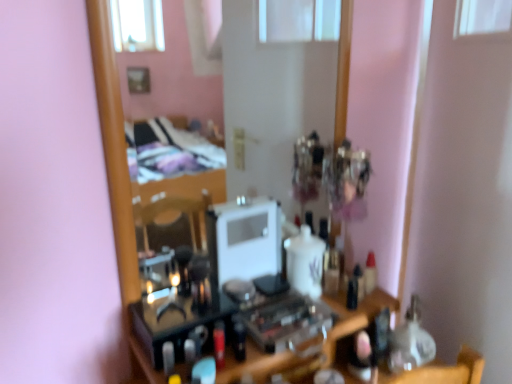
Question: From the image's perspective, is wooden mirror at center above or below translucent plastic bottle at center?

Choices:
 (A) above
 (B) below

Answer: (A)

Question: Is wooden mirror at center to the left or to the right of translucent plastic bottle at center in the image?

Choices:
 (A) left
 (B) right

Answer: (A)

Question: Is wooden mirror at center in front of or behind translucent plastic bottle at center in the image?

Choices:
 (A) behind
 (B) front

Answer: (B)

Question: Choose the correct answer: Is translucent plastic bottle at center inside wooden mirror at center or outside it?

Choices:
 (A) outside
 (B) inside

Answer: (A)

Question: From a real-world perspective, is translucent plastic bottle at center above or below wooden mirror at center?

Choices:
 (A) below
 (B) above

Answer: (A)

Question: Relative to wooden mirror at center, is translucent plastic bottle at center in front or behind?

Choices:
 (A) behind
 (B) front

Answer: (A)

Question: Considering the positions of translucent plastic bottle at center and wooden mirror at center in the image, is translucent plastic bottle at center bigger or smaller than wooden mirror at center?

Choices:
 (A) big
 (B) small

Answer: (B)